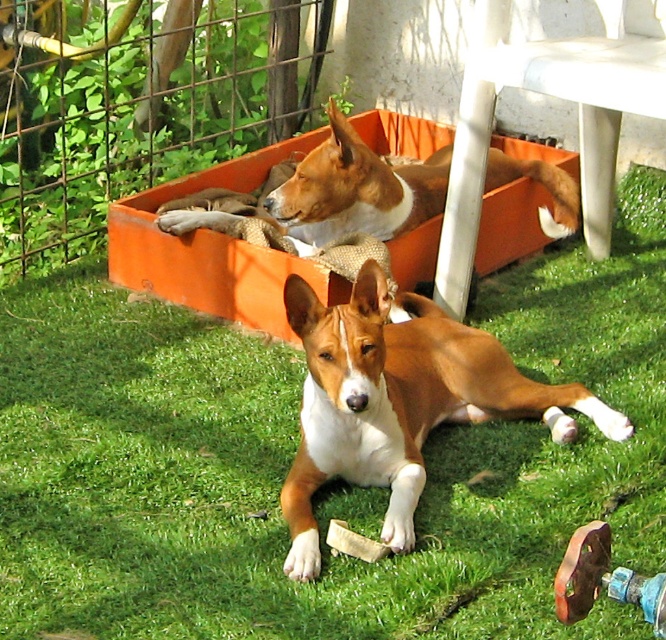
Is orange plastic crate at upper center positioned at the back of brown/white fur dog at upper center?

Yes, it is.

At what (x,y) coordinates should I click in order to perform the action: click on orange plastic crate at upper center. Please return your answer as a coordinate pair (x, y). Image resolution: width=666 pixels, height=640 pixels. Looking at the image, I should click on tap(212, 250).

Which is more to the right, green grass at center or brown/white fur dog at center?

From the viewer's perspective, brown/white fur dog at center appears more on the right side.

Based on the photo, is green grass at center taller than brown/white fur dog at center?

Yes.

Is point (25, 616) positioned after point (354, 310)?

No.

Where is `green grass at center`? green grass at center is located at coordinates (292, 452).

Can you confirm if brown/white fur dog at center is positioned below orange plastic crate at upper center?

Yes.

Is brown/white fur dog at center positioned at the back of orange plastic crate at upper center?

No, brown/white fur dog at center is in front of orange plastic crate at upper center.

At what (x,y) coordinates should I click in order to perform the action: click on brown/white fur dog at center. Please return your answer as a coordinate pair (x, y). Image resolution: width=666 pixels, height=640 pixels. Looking at the image, I should click on (400, 401).